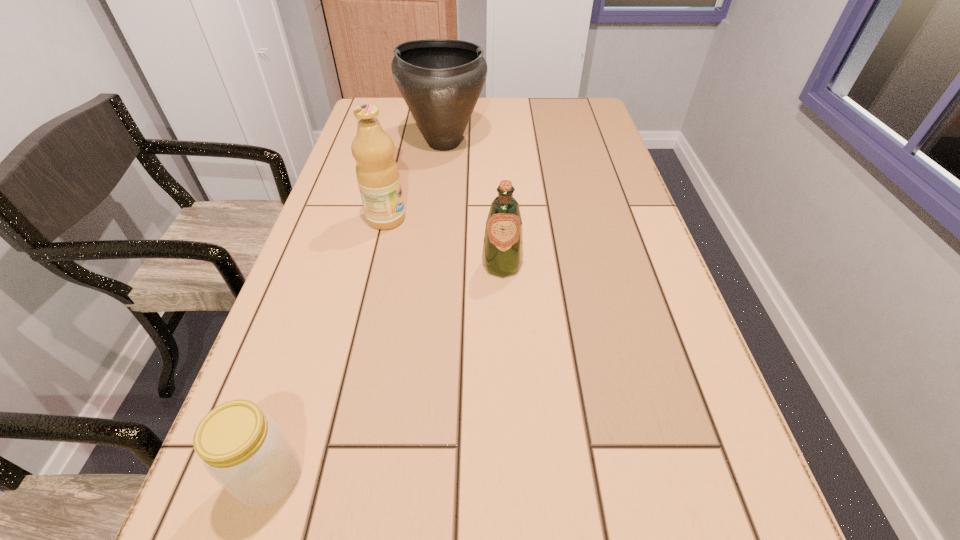
Find the location of a particular element. free location located 0.200m on the back of the nearest object is located at coordinates (315, 339).

This screenshot has width=960, height=540. In order to click on object at the far edge in this screenshot , I will do 440,80.

In order to click on olive oil situated at the left edge in this screenshot , I will do `click(377, 173)`.

In order to click on urn that is at the left edge in this screenshot , I will do `click(440, 80)`.

Image resolution: width=960 pixels, height=540 pixels. Find the location of `jar that is positioned at the left edge`. jar that is positioned at the left edge is located at coordinates (243, 449).

Find the location of a particular element. object that is at the far left corner is located at coordinates (440, 80).

Locate an element on the screen. The width and height of the screenshot is (960, 540). vacant space at the far edge is located at coordinates (492, 102).

Locate an element on the screen. The width and height of the screenshot is (960, 540). free region at the left edge is located at coordinates (330, 195).

This screenshot has width=960, height=540. What are the coordinates of `free space at the right edge` in the screenshot? It's located at (611, 279).

You are a GUI agent. You are given a task and a screenshot of the screen. Output one action in this format:
    pyautogui.click(x=<x>, y=<y>)
    Task: Click on the free space between the nearer olive oil and the farthest object
    
    Given the screenshot: What is the action you would take?
    pyautogui.click(x=473, y=204)